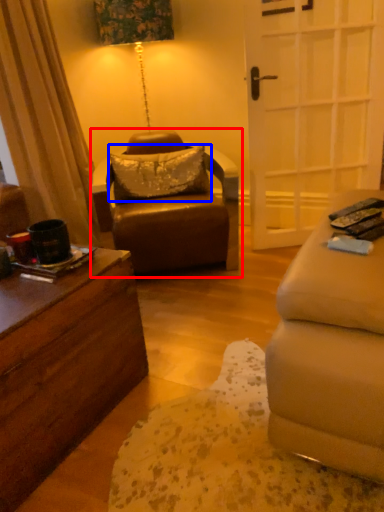
Question: Among these objects, which one is farthest to the camera, chair (highlighted by a red box) or pillow (highlighted by a blue box)?

Choices:
 (A) chair
 (B) pillow

Answer: (B)